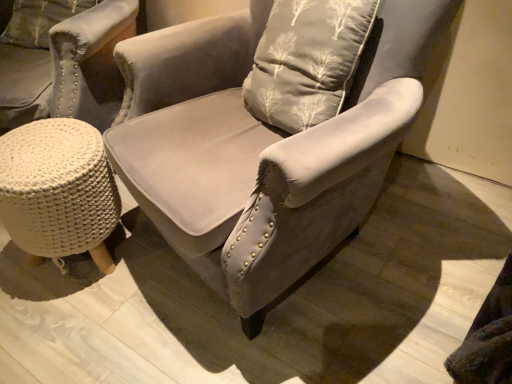
Question: Could you tell me if white knitted stool at lower left is facing velvet gray pillow with tree pattern at upper left?

Choices:
 (A) no
 (B) yes

Answer: (A)

Question: Is white knitted stool at lower left touching velvet gray pillow with tree pattern at upper left?

Choices:
 (A) no
 (B) yes

Answer: (A)

Question: Can you confirm if white knitted stool at lower left is smaller than velvet gray pillow with tree pattern at upper left?

Choices:
 (A) no
 (B) yes

Answer: (A)

Question: Is white knitted stool at lower left behind velvet gray pillow with tree pattern at upper left?

Choices:
 (A) yes
 (B) no

Answer: (B)

Question: Could velvet gray pillow with tree pattern at upper left be considered to be inside white knitted stool at lower left?

Choices:
 (A) yes
 (B) no

Answer: (B)

Question: In terms of width, does suede gray armchair at center look wider or thinner when compared to velvet gray pillow with tree pattern at upper left?

Choices:
 (A) wide
 (B) thin

Answer: (A)

Question: Is point (164, 87) positioned closer to the camera than point (55, 9)?

Choices:
 (A) closer
 (B) farther

Answer: (A)

Question: In terms of height, does suede gray armchair at center look taller or shorter compared to velvet gray pillow with tree pattern at upper left?

Choices:
 (A) tall
 (B) short

Answer: (A)

Question: Looking at the image, does suede gray armchair at center seem bigger or smaller compared to velvet gray pillow with tree pattern at upper left?

Choices:
 (A) small
 (B) big

Answer: (B)

Question: From their relative heights in the image, would you say suede gray armchair at center is taller or shorter than white knitted stool at lower left?

Choices:
 (A) tall
 (B) short

Answer: (A)

Question: Does point (205, 220) appear closer or farther from the camera than point (78, 238)?

Choices:
 (A) farther
 (B) closer

Answer: (B)

Question: From a real-world perspective, is suede gray armchair at center above or below white knitted stool at lower left?

Choices:
 (A) above
 (B) below

Answer: (A)

Question: Looking at their shapes, would you say suede gray armchair at center is wider or thinner than white knitted stool at lower left?

Choices:
 (A) thin
 (B) wide

Answer: (B)

Question: Is point (118, 201) positioned closer to the camera than point (15, 8)?

Choices:
 (A) closer
 (B) farther

Answer: (A)

Question: Would you say white knitted stool at lower left is inside or outside velvet gray pillow with tree pattern at upper left?

Choices:
 (A) outside
 (B) inside

Answer: (A)